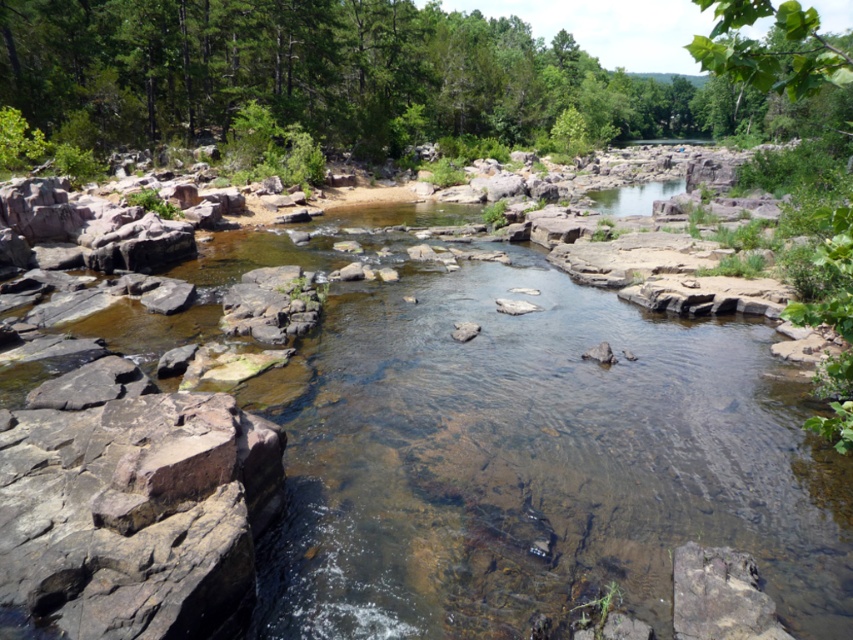
Who is more forward, [834,426] or [630,189]?

Point [834,426] is in front.

Which is above, green leafy tree at upper right or clear water at center?

green leafy tree at upper right is above.

Between point (851, 349) and point (643, 211), which one is positioned behind?

The point (643, 211) is behind.

The width and height of the screenshot is (853, 640). I want to click on green leafy tree at upper right, so click(x=770, y=49).